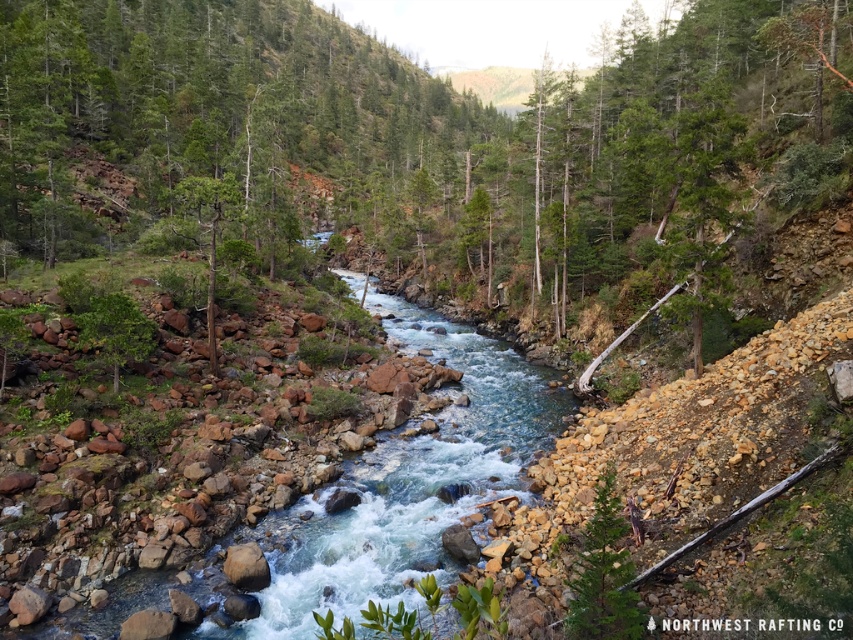
Question: Can you confirm if green matte tree at lower right is bigger than green rough bark tree at center-left?

Choices:
 (A) yes
 (B) no

Answer: (B)

Question: Which point is closer to the camera?

Choices:
 (A) (206, 196)
 (B) (583, 570)

Answer: (B)

Question: Which point is closer to the camera?

Choices:
 (A) (612, 496)
 (B) (224, 209)

Answer: (A)

Question: Which point is farther from the camera taking this photo?

Choices:
 (A) (199, 228)
 (B) (575, 596)

Answer: (A)

Question: Can you confirm if green matte tree at lower right is positioned to the left of green rough bark tree at center-left?

Choices:
 (A) yes
 (B) no

Answer: (B)

Question: From the image, what is the correct spatial relationship of green matte tree at lower right in relation to green rough bark tree at center-left?

Choices:
 (A) left
 (B) right

Answer: (B)